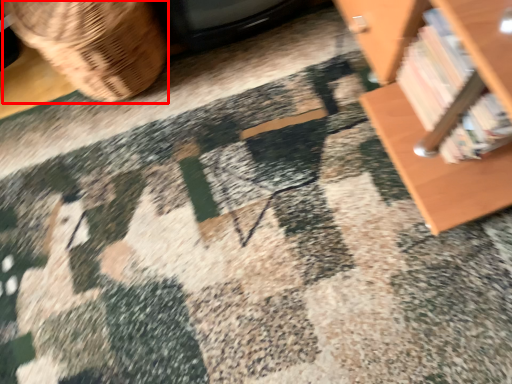
Question: From the image, what is the correct spatial relationship of basket (annotated by the red box) in relation to book?

Choices:
 (A) left
 (B) right

Answer: (A)